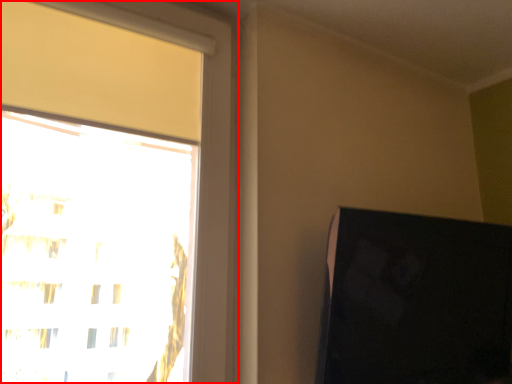
Question: From the image's perspective, considering the relative positions of window (annotated by the red box) and computer monitor in the image provided, where is window (annotated by the red box) located with respect to the staircase?

Choices:
 (A) below
 (B) above

Answer: (B)